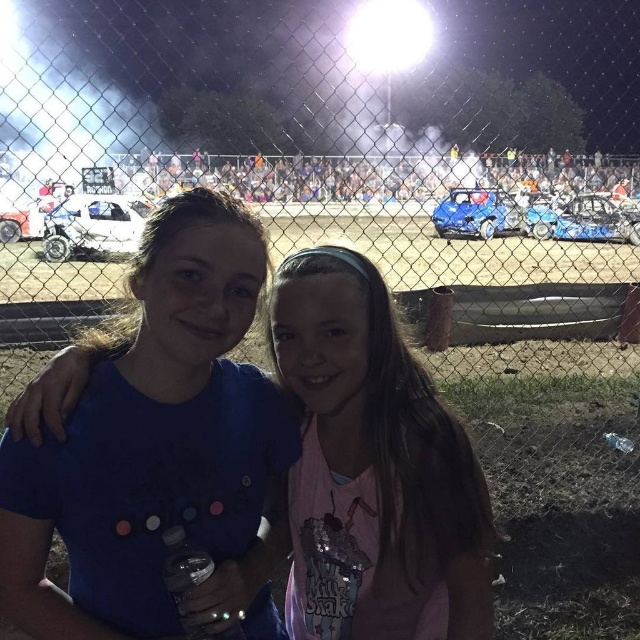
Can you confirm if blue cotton shirt at center is smaller than matte white car at left?

Correct, blue cotton shirt at center occupies less space than matte white car at left.

How far apart are blue cotton shirt at center and matte white car at left?

They are 11.51 meters apart.

You are a GUI agent. You are given a task and a screenshot of the screen. Output one action in this format:
    pyautogui.click(x=<x>, y=<y>)
    Task: Click on the blue cotton shirt at center
    The image size is (640, 640).
    Given the screenshot: What is the action you would take?
    pyautogui.click(x=372, y=468)

Between point (397, 593) and point (45, 195), which one is positioned in front?

Point (397, 593)

Does pink fabric shirt at center have a larger size compared to matte white car at left?

No.

Who is more forward, (451, 419) or (26, 218)?

Positioned in front is point (451, 419).

Where is `pink fabric shirt at center`? pink fabric shirt at center is located at coordinates [372, 467].

Does point (372, 301) come in front of point (124, 214)?

Yes, it is in front of point (124, 214).

Can you confirm if pink fabric shirt at center is bigger than white matte car at center?

No, pink fabric shirt at center is not bigger than white matte car at center.

Which is behind, point (323, 417) or point (124, 205)?

The point (124, 205) is more distant.

Locate an element on the screen. The height and width of the screenshot is (640, 640). pink fabric shirt at center is located at coordinates (372, 467).